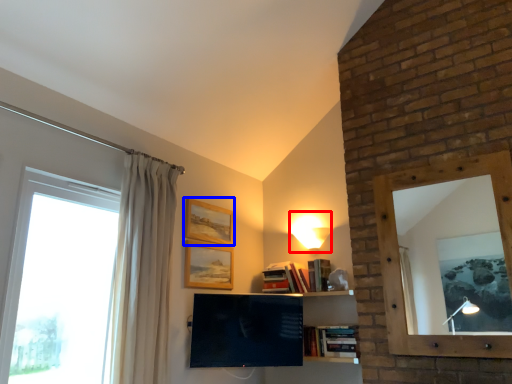
Question: Which object appears farthest to the camera in this image, light (highlighted by a red box) or picture frame (highlighted by a blue box)?

Choices:
 (A) light
 (B) picture frame

Answer: (A)